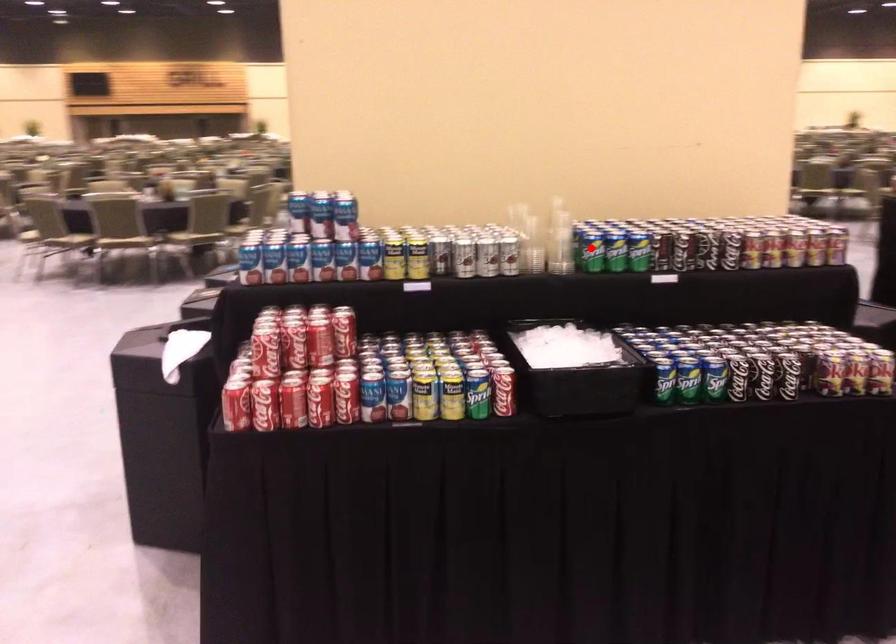
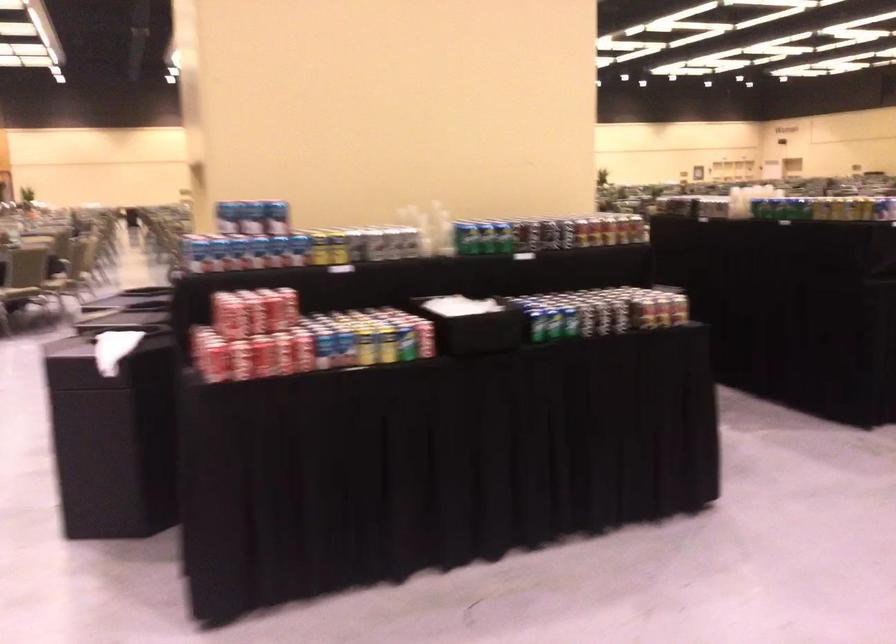
Locate, in the second image, the point that corresponds to the highlighted location in the first image.

(466, 238)